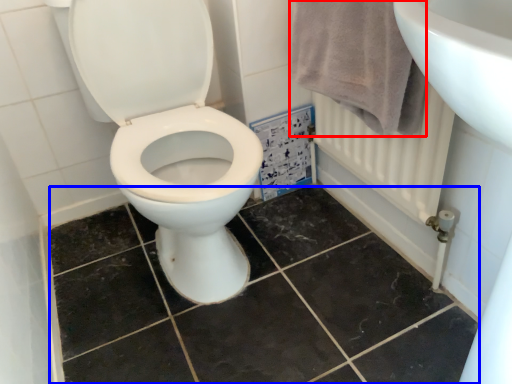
Question: Which point is further to the camera, bath towel (highlighted by a red box) or ceramic tile (highlighted by a blue box)?

Choices:
 (A) bath towel
 (B) ceramic tile

Answer: (A)